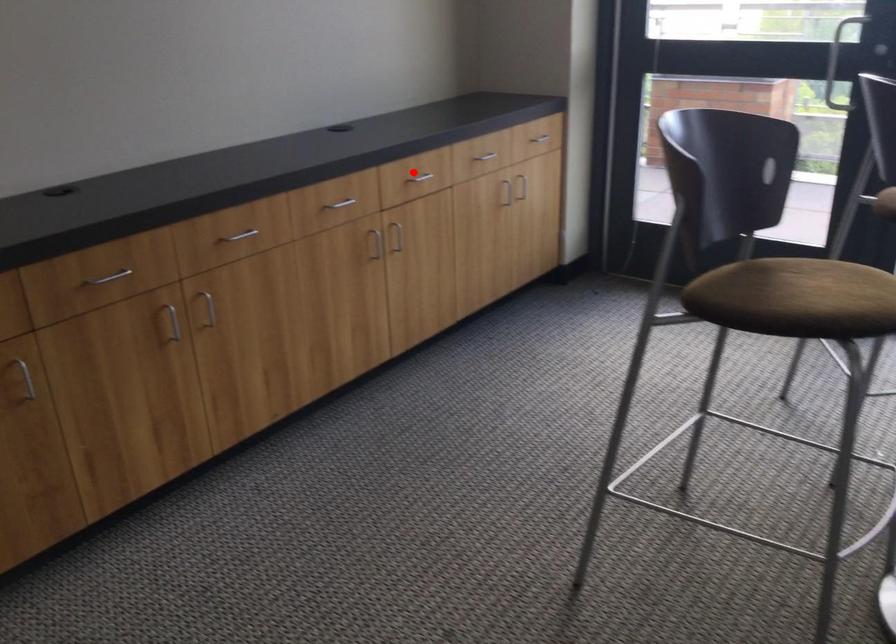
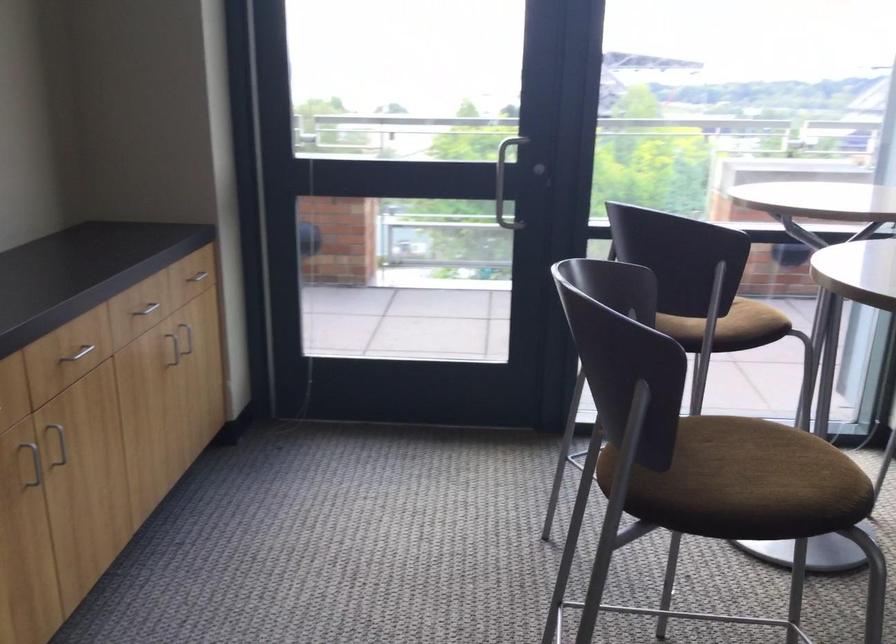
In the second image, find the point that corresponds to the highlighted location in the first image.

(80, 353)